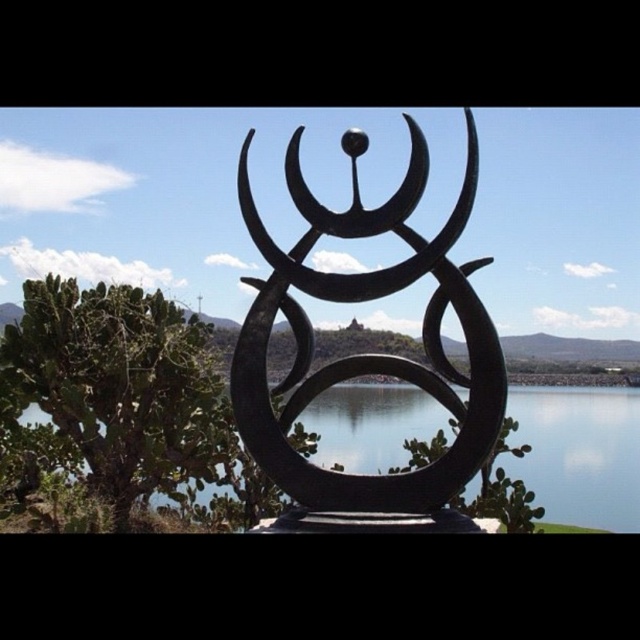
Between black matte sculpture at center and transparent glass water at center, which one has less height?

Standing shorter between the two is transparent glass water at center.

Consider the image. Does black matte sculpture at center appear on the right side of transparent glass water at center?

Incorrect, black matte sculpture at center is not on the right side of transparent glass water at center.

Measure the distance between point [460,452] and camera.

4.16 feet

I want to click on black matte sculpture at center, so click(368, 355).